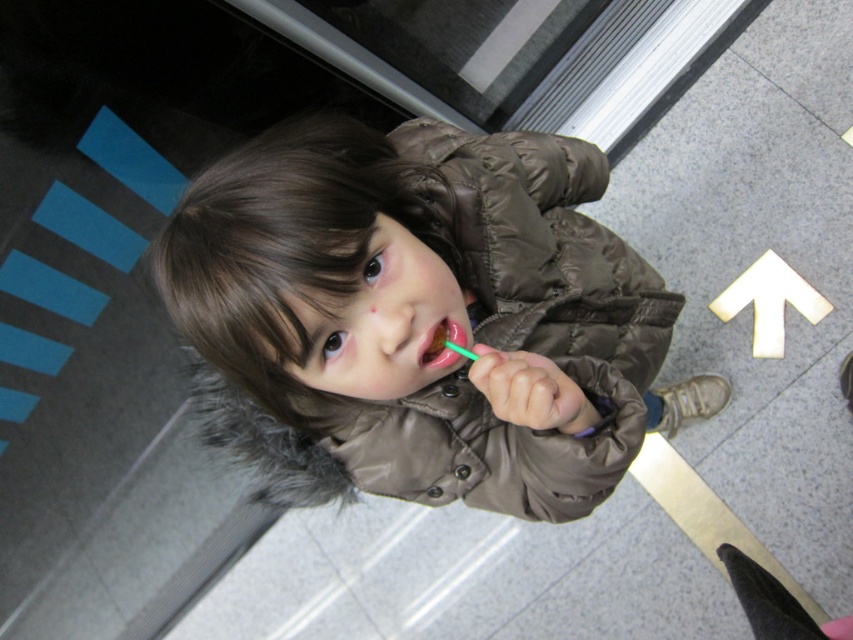
In the scene shown: How distant is brown puffy coat at center from green plastic toothbrush at center?

7.59 inches

Between brown puffy coat at center and green plastic toothbrush at center, which one appears on the left side from the viewer's perspective?

Positioned to the left is green plastic toothbrush at center.

The image size is (853, 640). In order to click on brown puffy coat at center in this screenshot , I will do `click(418, 314)`.

Where is `brown puffy coat at center`? The width and height of the screenshot is (853, 640). brown puffy coat at center is located at coordinates (418, 314).